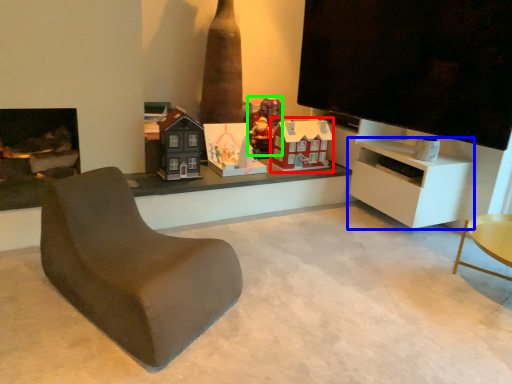
Question: Considering the real-world distances, which object is farthest from toy (highlighted by a red box)? cabinetry (highlighted by a blue box) or toy (highlighted by a green box)?

Choices:
 (A) cabinetry
 (B) toy

Answer: (A)